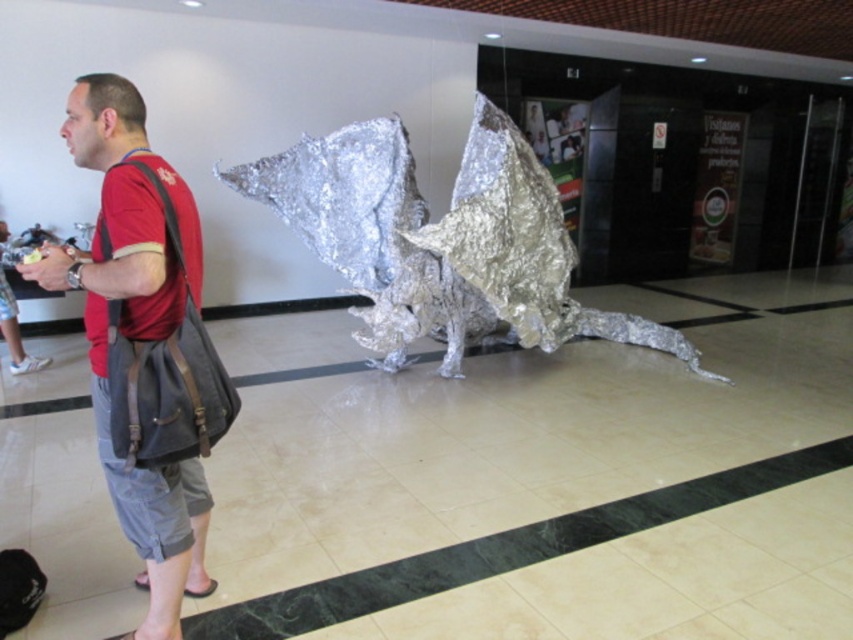
Measure the distance from shiny metallic dragon at center to red cotton t-shirt at left.

shiny metallic dragon at center and red cotton t-shirt at left are 7.98 feet apart.

Is point (486, 186) farther from camera compared to point (102, 284)?

Yes.

Who is more distant from viewer, (375, 244) or (128, 83)?

The point (375, 244) is more distant.

The height and width of the screenshot is (640, 853). Identify the location of shiny metallic dragon at center. (442, 241).